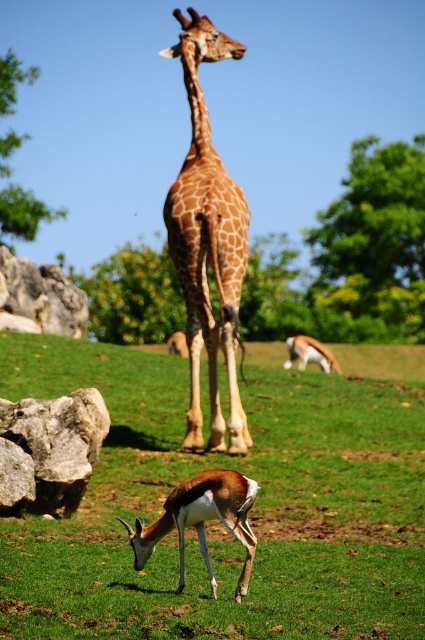
Between point (14, 413) and point (328, 365), which one is positioned behind?

Positioned behind is point (328, 365).

Does point (31, 504) come behind point (306, 346)?

No, it is in front of (306, 346).

You are a GUI agent. You are given a task and a screenshot of the screen. Output one action in this format:
    pyautogui.click(x=<x>, y=<y>)
    Task: Click on the gray rough rock at lower left
    The width and height of the screenshot is (425, 640).
    Given the screenshot: What is the action you would take?
    pyautogui.click(x=50, y=451)

Does shiny brown antelope at lower center appear under white glossy antelope at lower center?

Yes.

Does shiny brown antelope at lower center have a greater width compared to white glossy antelope at lower center?

Correct, the width of shiny brown antelope at lower center exceeds that of white glossy antelope at lower center.

Does point (204, 484) come in front of point (306, 358)?

Yes.

The width and height of the screenshot is (425, 640). I want to click on shiny brown antelope at lower center, so click(201, 520).

Is point (124, 449) more distant than point (319, 358)?

No, it is not.

Does green grass at center come in front of white glossy antelope at lower center?

Yes, green grass at center is closer to the viewer.

The image size is (425, 640). What do you see at coordinates (220, 525) in the screenshot? I see `green grass at center` at bounding box center [220, 525].

Locate an element on the screen. This screenshot has height=640, width=425. green grass at center is located at coordinates (220, 525).